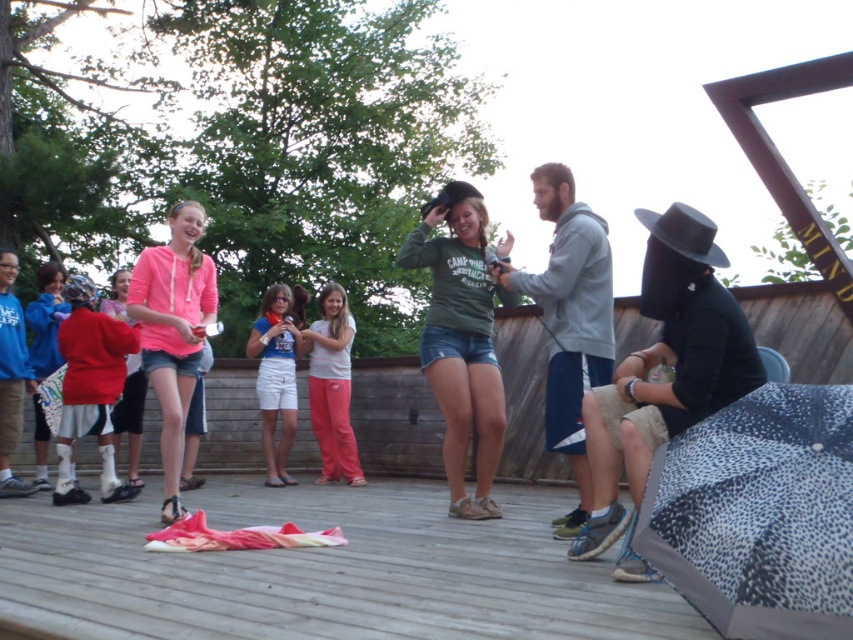
You are planning to place a rectangular picnic basket that is 1.2 meters wide on the wooden deck at center. Considering the black matte hat at lower right is nearby, will the deck have enough width to accommodate the basket without overlapping the hat?

The wooden deck at center is wider than the black matte hat at lower right, so there should be enough space to place the picnic basket without overlapping the hat.

You are standing on the wooden deck and want to see the black felt cowboy hat at center. Is the black matte hat at lower right blocking your view of it?

Yes, the black matte hat at lower right is in front of the black felt cowboy hat at center, so it would block your view of the latter.

You are standing on the wooden deck at center and want to toss a frisbee to the matte red jacket at left. Which direction should you throw the frisbee to ensure it reaches them?

The wooden deck at center is below the matte red jacket at left, so you should throw the frisbee upwards towards the matte red jacket at left.